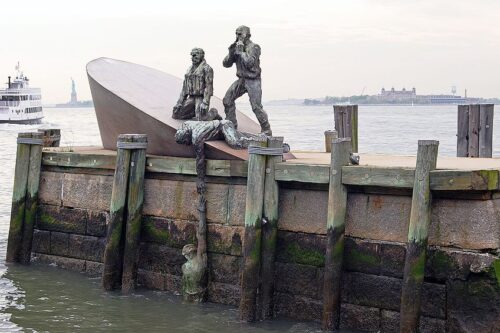
The image size is (500, 333). I want to click on statue hands, so pos(199,207), pos(200,189), pos(202,101).